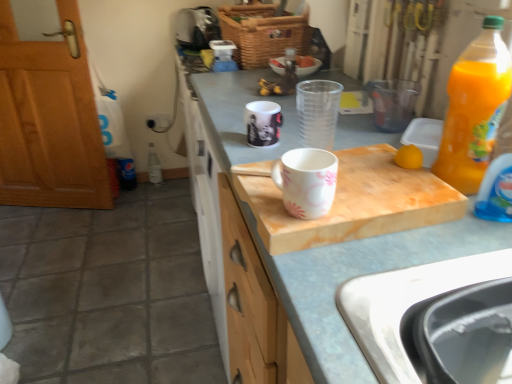
Question: Is black plastic sink at lower right facing towards white marble cutting board at center?

Choices:
 (A) yes
 (B) no

Answer: (B)

Question: Can you confirm if black plastic sink at lower right is taller than white marble cutting board at center?

Choices:
 (A) yes
 (B) no

Answer: (A)

Question: From a real-world perspective, is black plastic sink at lower right physically below white marble cutting board at center?

Choices:
 (A) no
 (B) yes

Answer: (B)

Question: Is black plastic sink at lower right facing away from white marble cutting board at center?

Choices:
 (A) yes
 (B) no

Answer: (B)

Question: Considering the relative sizes of black plastic sink at lower right and white marble cutting board at center in the image provided, is black plastic sink at lower right bigger than white marble cutting board at center?

Choices:
 (A) yes
 (B) no

Answer: (A)

Question: In the image, is black plastic sink at lower right on the left side or the right side of translucent plastic bottle at right, positioned as the second bottle in top-to-bottom order?

Choices:
 (A) right
 (B) left

Answer: (B)

Question: Is black plastic sink at lower right in front of or behind translucent plastic bottle at right, positioned as the second bottle in top-to-bottom order, in the image?

Choices:
 (A) front
 (B) behind

Answer: (A)

Question: Based on their sizes in the image, would you say black plastic sink at lower right is bigger or smaller than translucent plastic bottle at right, which is counted as the 2th bottle, starting from the left?

Choices:
 (A) big
 (B) small

Answer: (A)

Question: Considering the positions of black plastic sink at lower right and translucent plastic bottle at right, positioned as the second bottle in top-to-bottom order, in the image, is black plastic sink at lower right wider or thinner than translucent plastic bottle at right, positioned as the second bottle in top-to-bottom order,?

Choices:
 (A) thin
 (B) wide

Answer: (B)

Question: Based on their positions, is translucent plastic bottle at right, which is counted as the 2th bottle, starting from the left, located to the left or right of woven brown basket at upper center?

Choices:
 (A) left
 (B) right

Answer: (B)

Question: Relative to woven brown basket at upper center, is translucent plastic bottle at right, the 1th bottle positioned from the right, in front or behind?

Choices:
 (A) front
 (B) behind

Answer: (A)

Question: Is translucent plastic bottle at right, positioned as the second bottle in top-to-bottom order, bigger or smaller than woven brown basket at upper center?

Choices:
 (A) small
 (B) big

Answer: (A)

Question: From the image's perspective, is translucent plastic bottle at right, which appears as the 1th bottle when viewed from the front, above or below woven brown basket at upper center?

Choices:
 (A) below
 (B) above

Answer: (A)

Question: Would you say white marble cutting board at center is inside or outside white glossy mug at center, the second coffee cup positioned from the front?

Choices:
 (A) outside
 (B) inside

Answer: (A)

Question: In terms of height, does white marble cutting board at center look taller or shorter compared to white glossy mug at center, the second coffee cup positioned from the front?

Choices:
 (A) short
 (B) tall

Answer: (B)